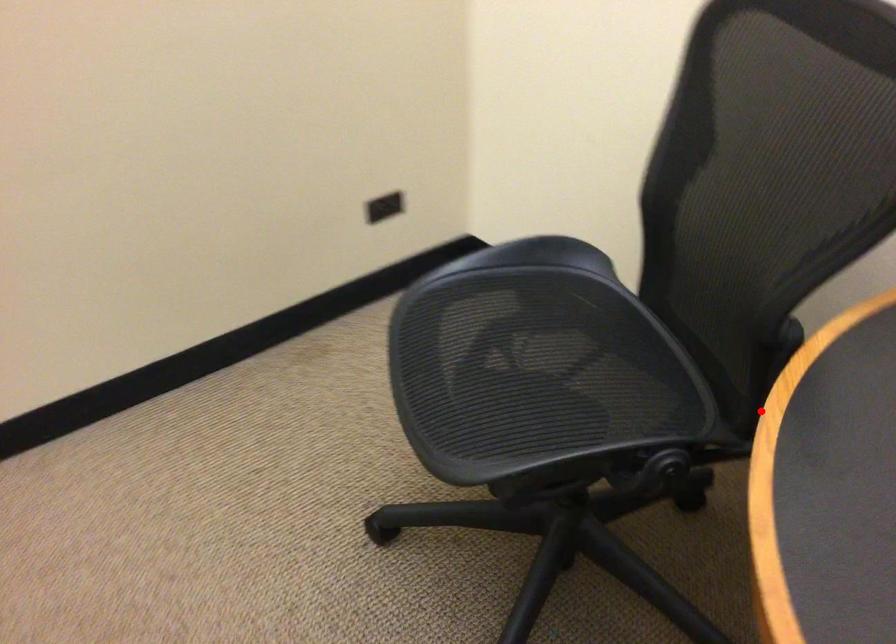
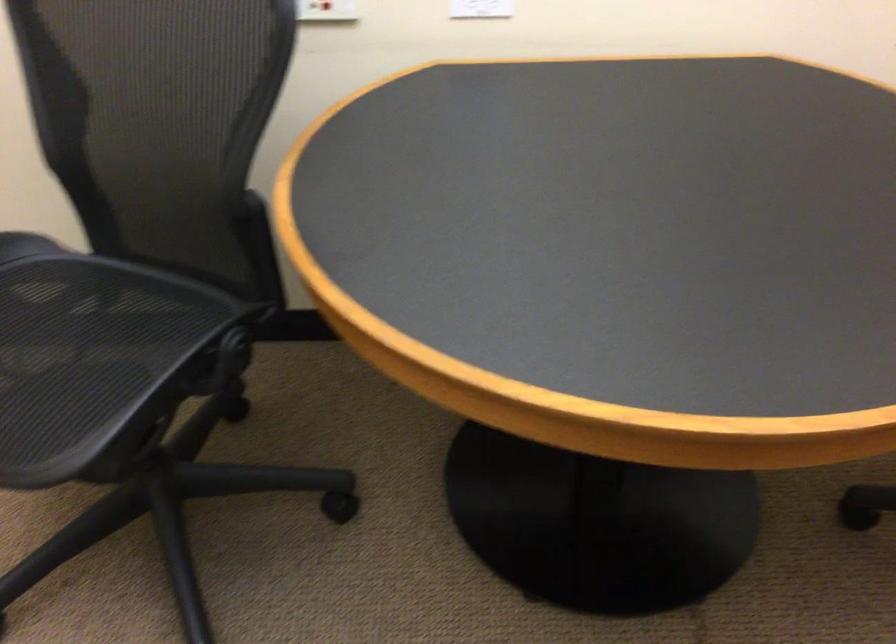
In the second image, find the point that corresponds to the highlighted location in the first image.

(264, 277)